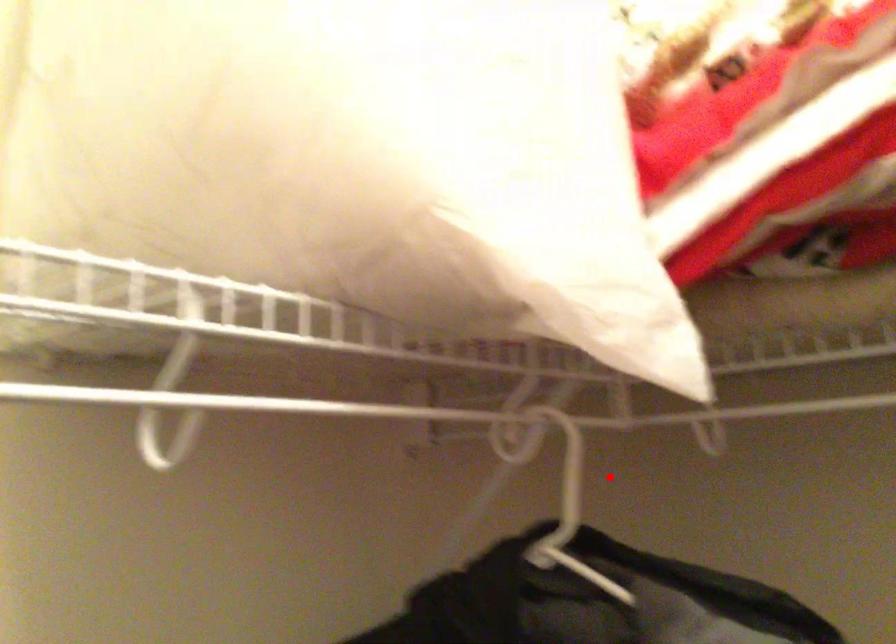
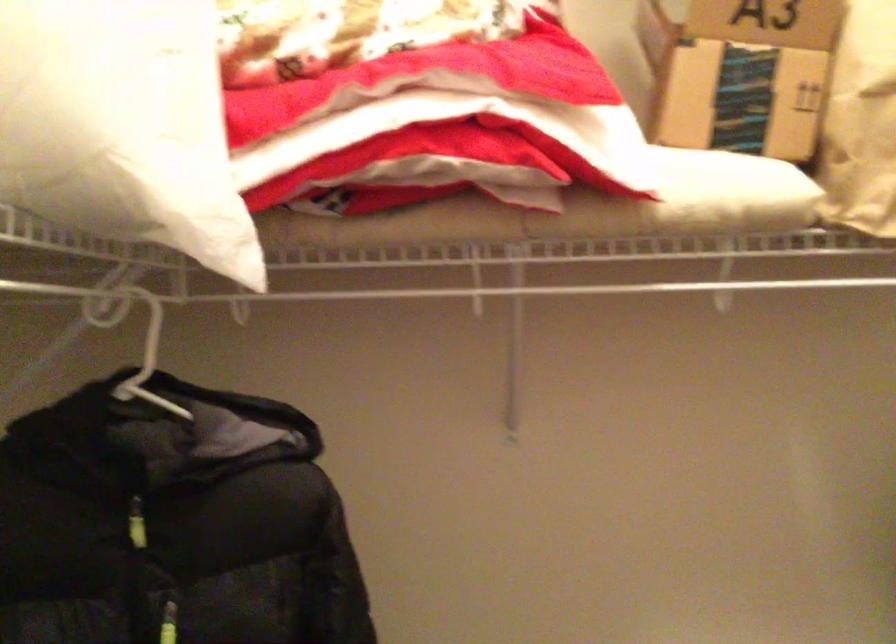
The point at the highlighted location is marked in the first image. Where is the corresponding point in the second image?

(138, 344)